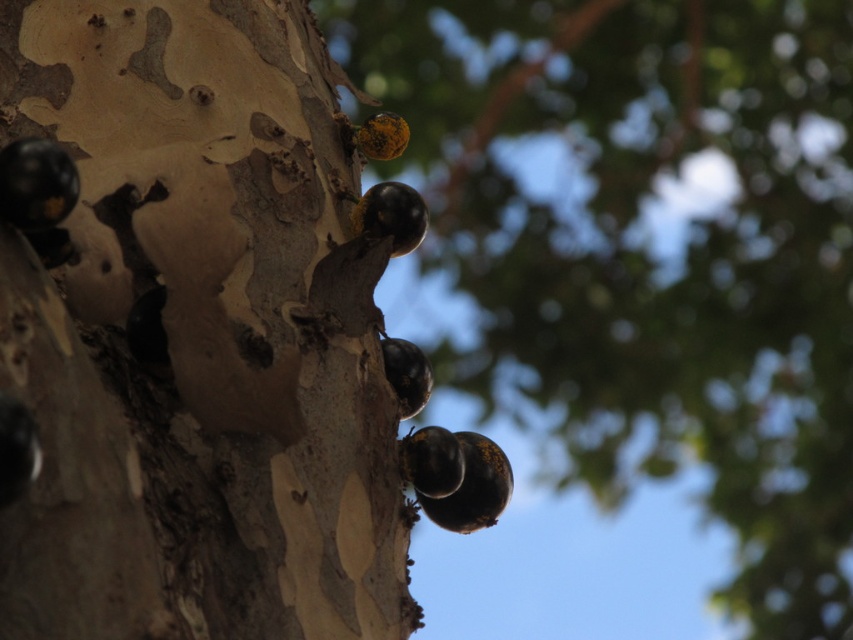
Question: Does matte bark tree trunk at upper left have a lesser width compared to shiny black berries at upper center?

Choices:
 (A) no
 (B) yes

Answer: (B)

Question: Is matte bark tree trunk at upper left wider than shiny black berries at upper center?

Choices:
 (A) no
 (B) yes

Answer: (A)

Question: Which point is closer to the camera?

Choices:
 (A) (218, 476)
 (B) (476, 97)

Answer: (A)

Question: Can you confirm if matte bark tree trunk at upper left is smaller than shiny black berries at upper center?

Choices:
 (A) no
 (B) yes

Answer: (B)